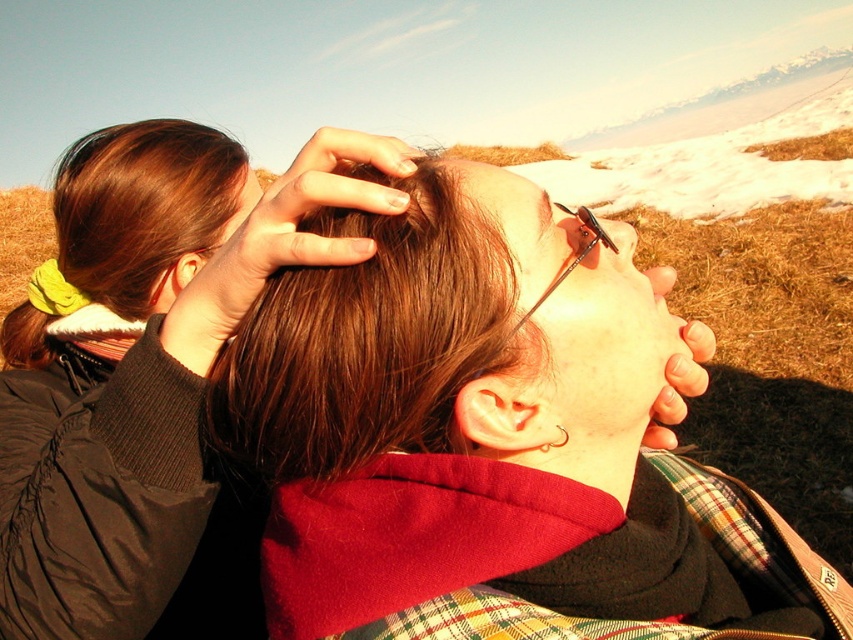
Question: Where is brown shiny hair at center located in relation to smooth brown hair at center in the image?

Choices:
 (A) above
 (B) below

Answer: (B)

Question: Which is nearer to the black plastic goggles at center?

Choices:
 (A) matte red fleece at center
 (B) smooth brown hair at center
 (C) light brown silky hair at upper left
 (D) matte black jacket at upper left

Answer: (B)

Question: Which object is farther from the camera taking this photo?

Choices:
 (A) smooth brown hair at center
 (B) brown shiny hair at center
 (C) light brown silky hair at upper left
 (D) matte red fleece at center

Answer: (C)

Question: Which of these objects is positioned farthest from the brown shiny hair at center?

Choices:
 (A) smooth brown hair at center
 (B) matte black jacket at upper left

Answer: (B)

Question: Is matte red fleece at center wider than black plastic goggles at center?

Choices:
 (A) yes
 (B) no

Answer: (A)

Question: Does matte black jacket at upper left have a smaller size compared to brown shiny hair at center?

Choices:
 (A) no
 (B) yes

Answer: (A)